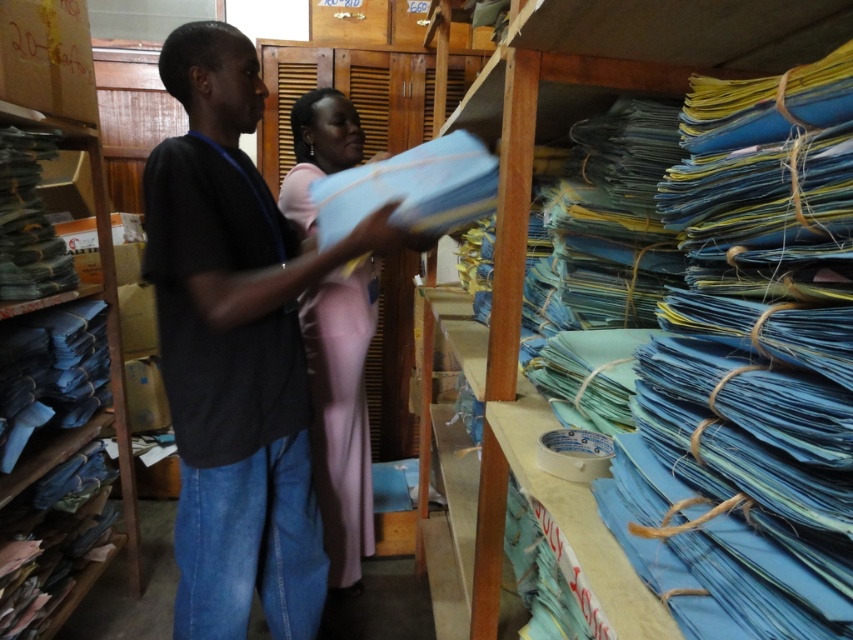
You are organizing the storage area and need to place a tall box on the shelf. The box is taller than the black matte shirt at center. Can the pink fabric at center reach the top of the box?

The black matte shirt at center is not as tall as pink fabric at center, so the pink fabric at center is taller. Since the box is taller than the black matte shirt at center, the pink fabric at center may or may not reach the top of the box depending on its exact height compared to the box.

You are organizing folders in the storage area and need to place a new bundle between the black matte shirt at center and the pink fabric at center. According to their positions, which side should you place the new bundle on?

The black matte shirt at center is positioned on the left side of pink fabric at center, so you should place the new bundle between them on the right side of the black matte shirt at center and the left side of the pink fabric at center.

What are the coordinates of the black matte shirt at center?

The coordinates of the black matte shirt at center are at point (235,349).